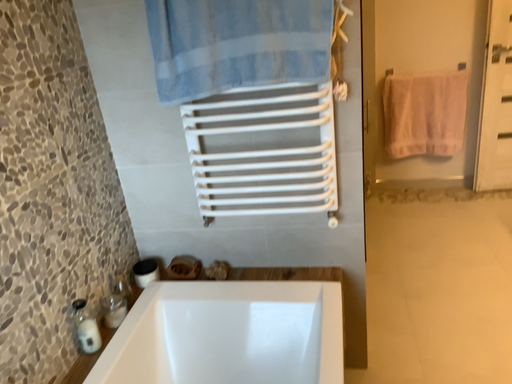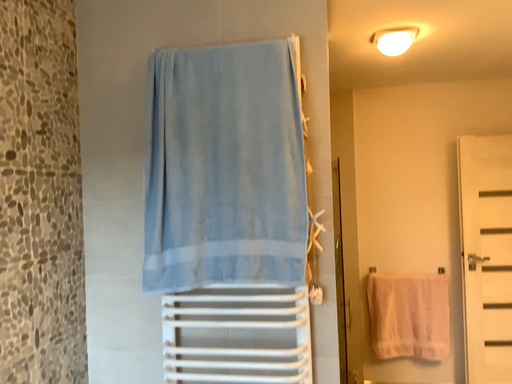
Question: Which way did the camera rotate in the video?

Choices:
 (A) rotated downward
 (B) rotated upward

Answer: (B)